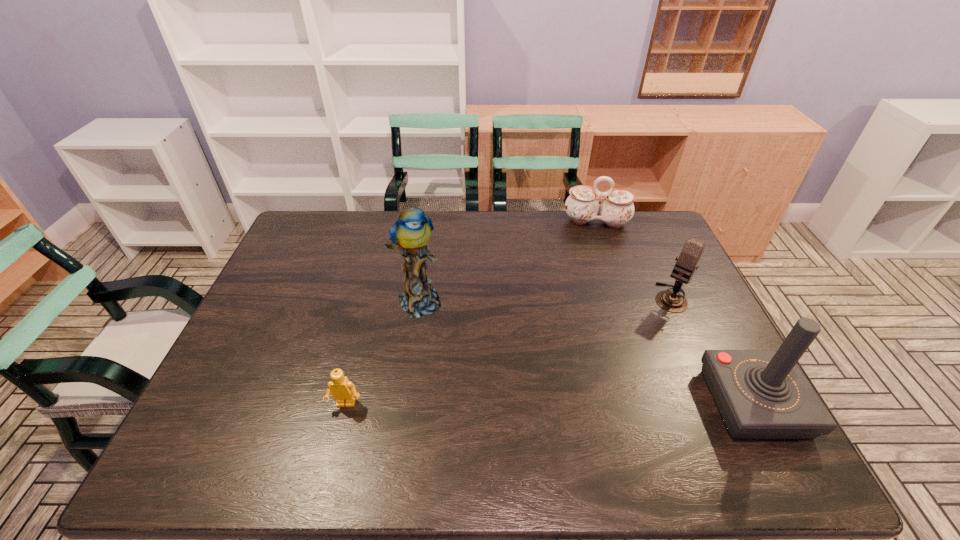
You are a GUI agent. You are given a task and a screenshot of the screen. Output one action in this format:
    pyautogui.click(x=<x>, y=<y>)
    Task: Click on the joystick situated at the right edge
    
    Given the screenshot: What is the action you would take?
    pyautogui.click(x=761, y=394)

The height and width of the screenshot is (540, 960). Identify the location of microphone at the right edge. (672, 301).

You are a GUI agent. You are given a task and a screenshot of the screen. Output one action in this format:
    pyautogui.click(x=<x>, y=<y>)
    Task: Click on the chinaware located in the right edge section of the desktop
    The width and height of the screenshot is (960, 540).
    Given the screenshot: What is the action you would take?
    pyautogui.click(x=582, y=206)

You are a GUI agent. You are given a task and a screenshot of the screen. Output one action in this format:
    pyautogui.click(x=<x>, y=<y>)
    Task: Click on the object located in the far right corner section of the desktop
    
    Given the screenshot: What is the action you would take?
    pyautogui.click(x=582, y=206)

The height and width of the screenshot is (540, 960). What are the coordinates of `object that is positioned at the near right corner` in the screenshot? It's located at (761, 394).

Find the location of `vacant space at the far edge`. vacant space at the far edge is located at coordinates (433, 217).

In the image, there is a desktop. Identify the location of blank space at the near edge. (599, 404).

Locate an element on the screen. vacant region at the left edge is located at coordinates (246, 381).

Identify the location of vacant space at the far left corner of the desktop. The image size is (960, 540). (326, 233).

Identify the location of vacant space in between the Lego and the joystick. (550, 404).